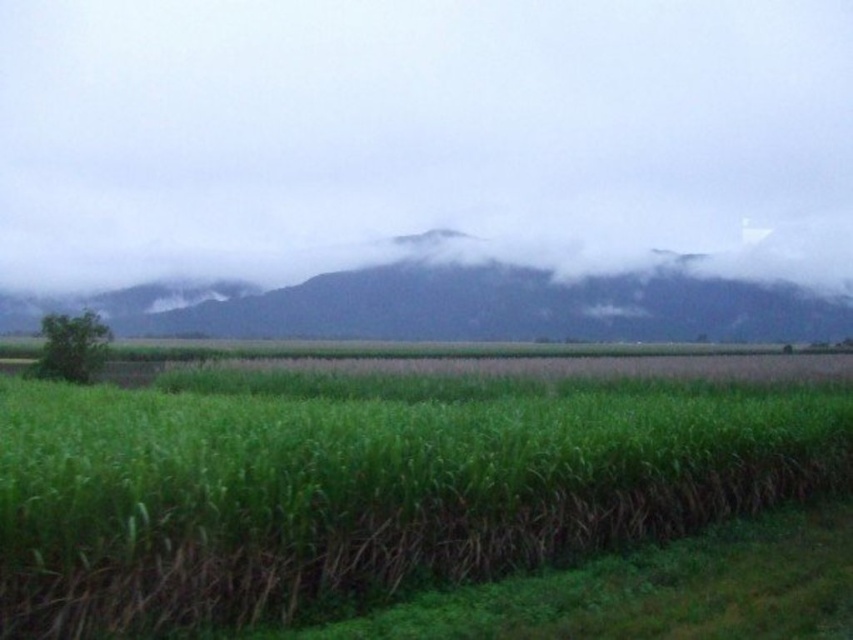
Question: Does green grassy corn field at center appear over green grassy field at upper center?

Choices:
 (A) no
 (B) yes

Answer: (A)

Question: Is green grassy corn field at center bigger than green grassy field at upper center?

Choices:
 (A) yes
 (B) no

Answer: (B)

Question: Is green grassy corn field at center bigger than green grassy field at upper center?

Choices:
 (A) yes
 (B) no

Answer: (B)